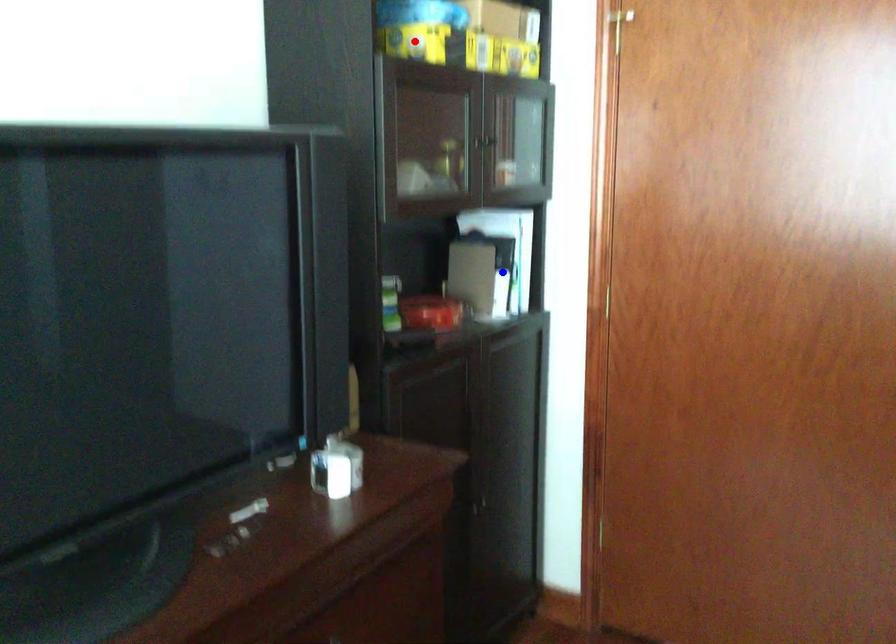
Question: Two points are marked on the image. Which point is closer to the camera?

Choices:
 (A) Blue point is closer.
 (B) Red point is closer.

Answer: (B)